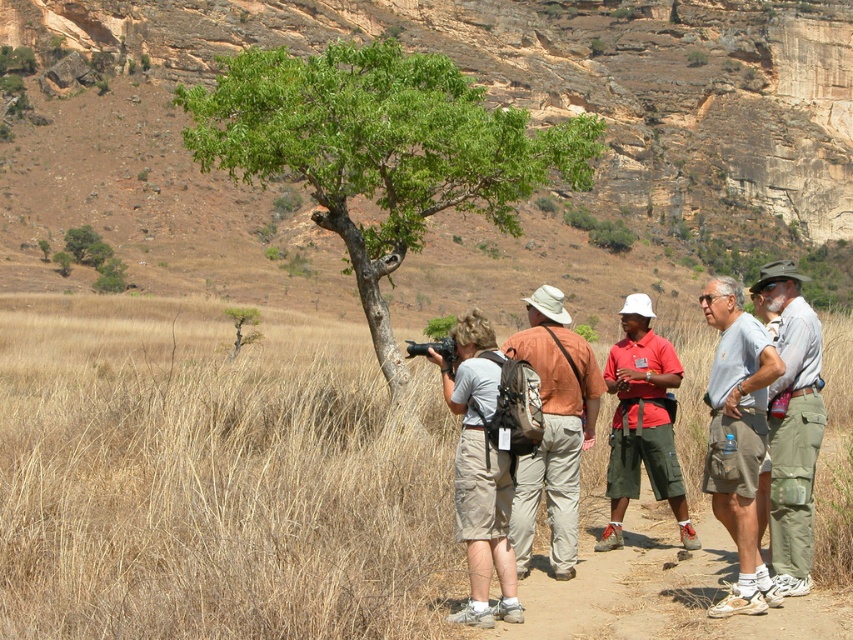
Question: Among these points, which one is farthest from the camera?

Choices:
 (A) (495, 616)
 (B) (785, 545)

Answer: (B)

Question: Among these objects, which one is nearest to the camera?

Choices:
 (A) gray fabric shirt at center-right
 (B) matte brown shirt at center

Answer: (A)

Question: Which point is closer to the camera?

Choices:
 (A) (775, 275)
 (B) (746, 326)
 (C) (550, 451)
 (D) (186, 333)

Answer: (B)

Question: Does green leafy tree at center lie in front of red cotton shirt at center?

Choices:
 (A) no
 (B) yes

Answer: (A)

Question: Does gray fabric shirt at center-right appear on the left side of red cotton shirt at center?

Choices:
 (A) yes
 (B) no

Answer: (B)

Question: In this image, where is dry grass at center located relative to matte brown shirt at center?

Choices:
 (A) right
 (B) left

Answer: (B)